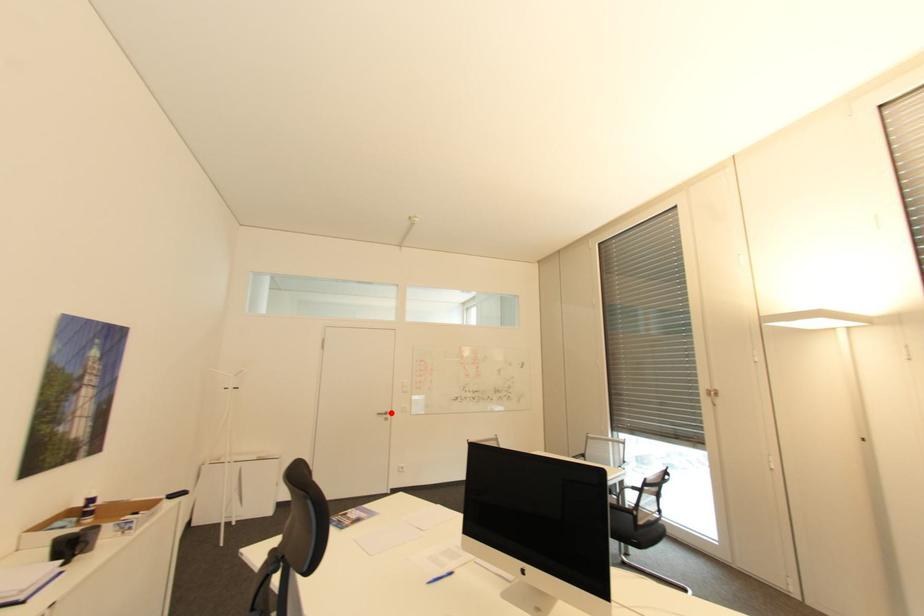
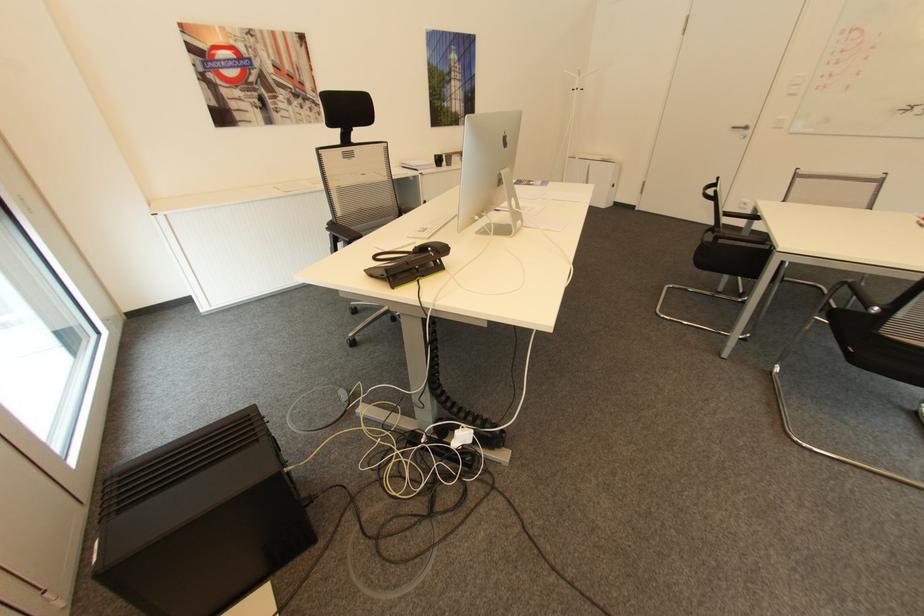
Question: A red point is marked in image1. In image2, is the corresponding 3D point closer to the camera or farther? Reply with the corresponding letter.

Choices:
 (A) The corresponding 3D point is closer.
 (B) The corresponding 3D point is farther.

Answer: (A)